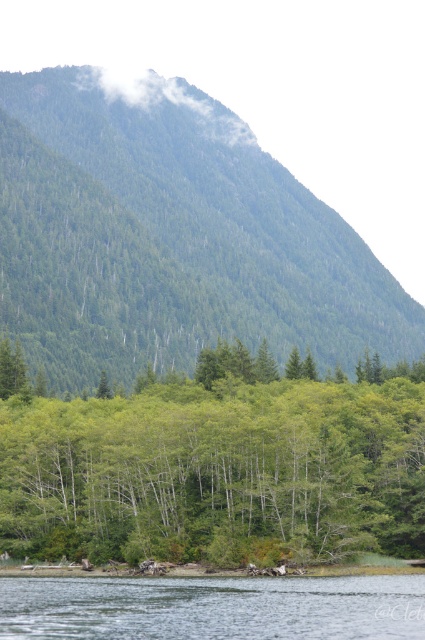
You are a hiker planning to take a photo of the green forested mountain at upper center and the clear water at lower center. Which object should you focus on first if you want to capture both in one frame without moving the camera?

You should focus on the green forested mountain at upper center first because it is larger than the clear water at lower center, so it requires more attention to ensure it is in focus before adjusting for the smaller clear water at lower center.

You are planning to take a photo of the green forested mountain at upper center and the clear water at lower center. Which object will appear larger in the photo due to its actual size?

The green forested mountain at upper center will appear larger in the photo because it is much taller than the clear water at lower center.

You are a hiker planning to take a photo of the green forested mountain at upper center. If you want to ensure the mountain is centered in your photo, which direction should you position yourself relative to the mountain?

To center the green forested mountain at upper center in your photo, you should position yourself directly in front of it, aligned with its central coordinates at point (170, 237).